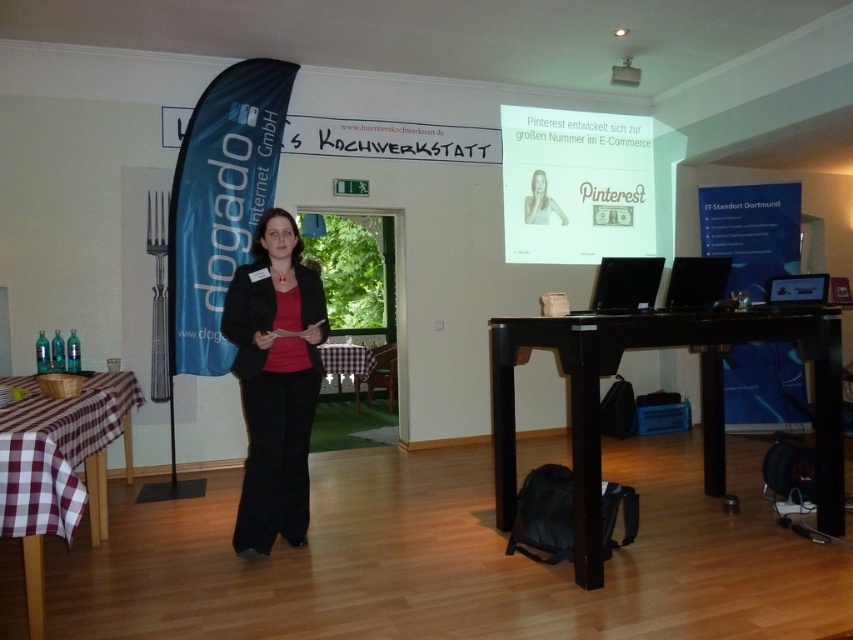
Measure the distance between checkered fabric table at lower left and camera.

They are 6.84 feet apart.

Can you confirm if checkered fabric table at lower left is bigger than black glossy laptop at center?

Indeed, checkered fabric table at lower left has a larger size compared to black glossy laptop at center.

Where is `checkered fabric table at lower left`? This screenshot has height=640, width=853. checkered fabric table at lower left is located at coordinates (59, 467).

Image resolution: width=853 pixels, height=640 pixels. What do you see at coordinates (59, 467) in the screenshot?
I see `checkered fabric table at lower left` at bounding box center [59, 467].

Between point (30, 397) and point (328, 364), which one is positioned in front?

Positioned in front is point (30, 397).

Where is `checkered fabric table at lower left`? The image size is (853, 640). checkered fabric table at lower left is located at coordinates (59, 467).

Is black glossy table at center to the left of smooth skin woman at center from the viewer's perspective?

In fact, black glossy table at center is to the right of smooth skin woman at center.

At what (x,y) coordinates should I click in order to perform the action: click on black glossy table at center. Please return your answer as a coordinate pair (x, y). This screenshot has width=853, height=640. Looking at the image, I should click on (700, 397).